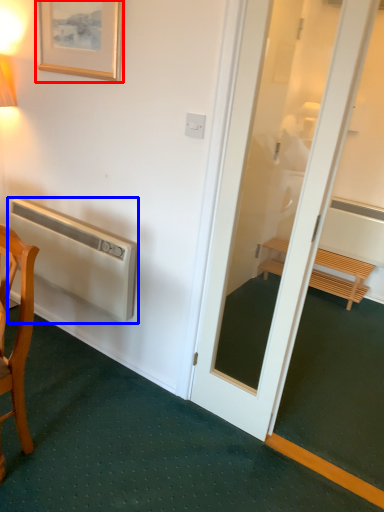
Question: Which object appears closest to the camera in this image, picture frame (highlighted by a red box) or air conditioner (highlighted by a blue box)?

Choices:
 (A) picture frame
 (B) air conditioner

Answer: (A)